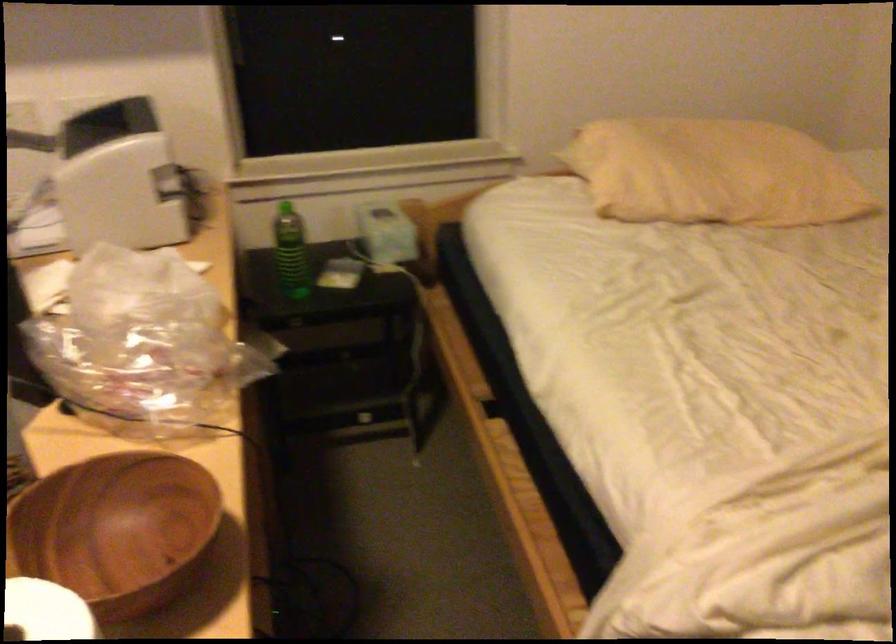
Find where to lift the light-colored tissue box. Please return your answer as a coordinate pair (x, y).

(385, 232)